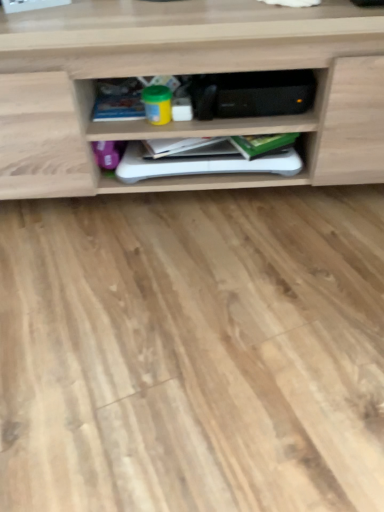
Question: In the image, is wooden shelf at center positioned in front of or behind green matte book at center, the third book in the left-to-right sequence?

Choices:
 (A) behind
 (B) front

Answer: (B)

Question: Looking at the image, does wooden shelf at center seem bigger or smaller compared to green matte book at center, which appears as the first book when viewed from the right?

Choices:
 (A) big
 (B) small

Answer: (A)

Question: Which is farther from the blue matte book at center, which appears as the third book when viewed from the right?

Choices:
 (A) green matte book at center, the third book in the left-to-right sequence
 (B) wooden shelf at center
 (C) white matte book at center, the 2th book in the right-to-left sequence

Answer: (A)

Question: Estimate the real-world distances between objects in this image. Which object is farther from the white matte book at center, placed as the second book when sorted from left to right?

Choices:
 (A) blue matte book at center, which appears as the third book when viewed from the right
 (B) wooden shelf at center
 (C) green matte book at center, which appears as the first book when viewed from the right

Answer: (A)